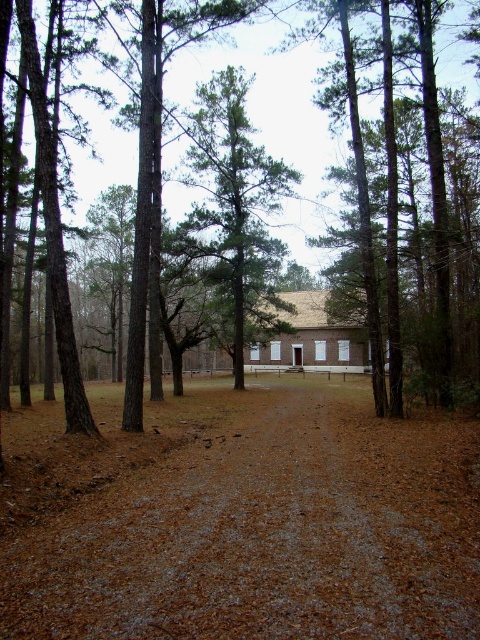
You are a hiker trying to find the shortest route to the building. You see the brown gravel path at center and the green leafy tree at center. Which one should you follow to reach the building quickly?

The brown gravel path at center is the correct route to follow since it is a designated path leading towards the building, while the green leafy tree at center is an obstacle blocking the way. However, according to the description, the brown gravel path at center occupies less space than the green leafy tree at center, so the path might be narrower but still navigable. The tree is larger in size but doesn

You are a hiker standing on the dirt path and want to take a photo of both the brown rough tree at center and the green leafy tree at center. Which tree should you position yourself to the left of to include both in your frame?

You should position yourself to the left of the green leafy tree at center because the brown rough tree at center is on its left side, allowing both trees to be captured in the photo.